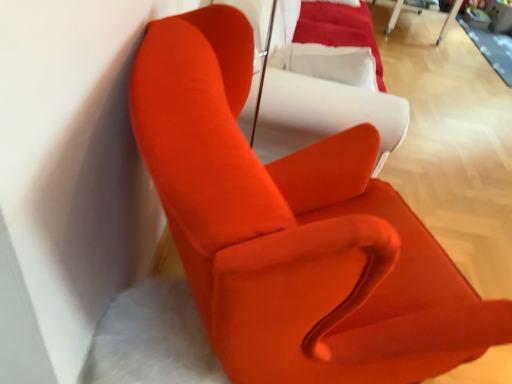
Question: Is white plastic table at upper right a part of matte orange armchair at upper left?

Choices:
 (A) no
 (B) yes

Answer: (A)

Question: Is matte orange armchair at upper left oriented away from white plastic table at upper right?

Choices:
 (A) no
 (B) yes

Answer: (A)

Question: From the image's perspective, is matte orange armchair at upper left on top of white plastic table at upper right?

Choices:
 (A) no
 (B) yes

Answer: (A)

Question: Is matte orange armchair at upper left to the right of white plastic table at upper right from the viewer's perspective?

Choices:
 (A) no
 (B) yes

Answer: (A)

Question: Is matte orange armchair at upper left positioned beyond the bounds of white plastic table at upper right?

Choices:
 (A) yes
 (B) no

Answer: (A)

Question: Is matte orange armchair at upper left not close to white plastic table at upper right?

Choices:
 (A) no
 (B) yes

Answer: (B)

Question: From a real-world perspective, is white plastic table at upper right physically below satin white couch at center?

Choices:
 (A) yes
 (B) no

Answer: (A)

Question: Can you confirm if white plastic table at upper right is shorter than satin white couch at center?

Choices:
 (A) yes
 (B) no

Answer: (B)

Question: From a real-world perspective, does white plastic table at upper right stand above satin white couch at center?

Choices:
 (A) yes
 (B) no

Answer: (B)

Question: Is the depth of white plastic table at upper right less than that of satin white couch at center?

Choices:
 (A) no
 (B) yes

Answer: (A)

Question: Considering the relative sizes of white plastic table at upper right and satin white couch at center in the image provided, is white plastic table at upper right thinner than satin white couch at center?

Choices:
 (A) no
 (B) yes

Answer: (A)

Question: Is white plastic table at upper right bigger than satin white couch at center?

Choices:
 (A) no
 (B) yes

Answer: (B)

Question: Is matte orange armchair at upper left in front of satin white couch at center?

Choices:
 (A) no
 (B) yes

Answer: (B)